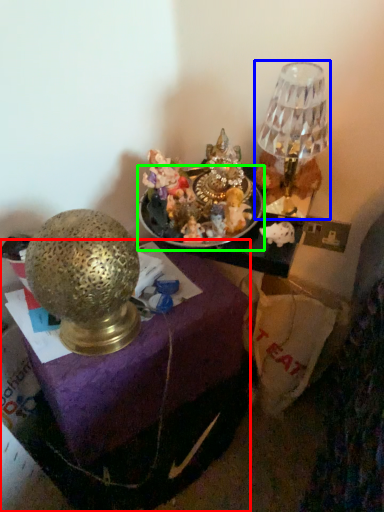
Question: Based on their relative distances, which object is nearer to furniture (highlighted by a red box)? Choose from lamp (highlighted by a blue box) and tableware (highlighted by a green box).

Choices:
 (A) lamp
 (B) tableware

Answer: (B)